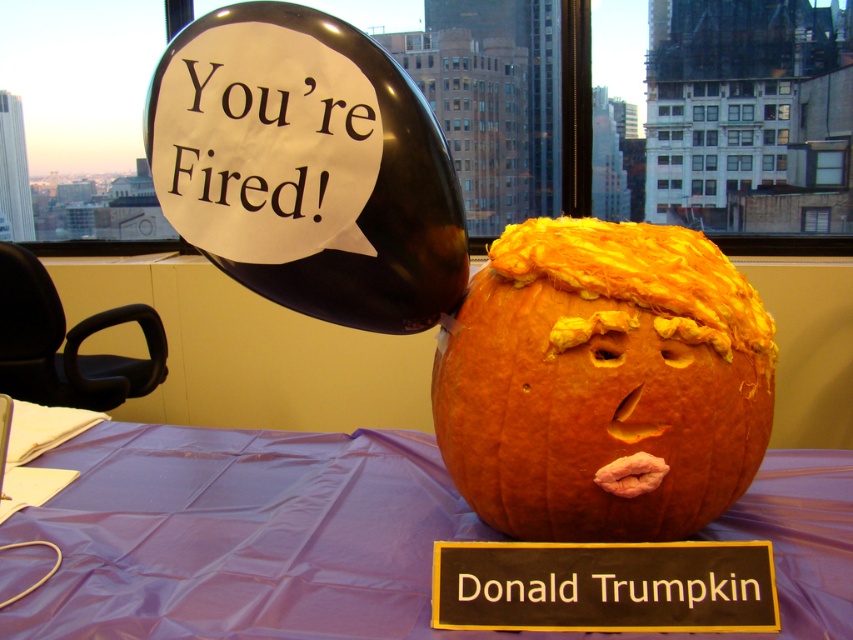
Who is lower down, orange carved pumpkin at center or blackmaterial/texturedonald trumpkin at center?

blackmaterial/texturedonald trumpkin at center

Measure the distance between point (614, 358) and camera.

Point (614, 358) and camera are 23.73 inches apart from each other.

Who is more distant from viewer, (663,292) or (566,584)?

The point (663,292) is behind.

The image size is (853, 640). I want to click on orange carved pumpkin at center, so click(604, 381).

Does orange pumpkin at center have a lesser width compared to blackmaterial/texturedonald trumpkin at center?

Incorrect, orange pumpkin at center's width is not less than blackmaterial/texturedonald trumpkin at center's.

Looking at this image, which of these two, orange pumpkin at center or blackmaterial/texturedonald trumpkin at center, stands shorter?

blackmaterial/texturedonald trumpkin at center is shorter.

Locate an element on the screen. The width and height of the screenshot is (853, 640). orange pumpkin at center is located at coordinates (242, 536).

Locate an element on the screen. The width and height of the screenshot is (853, 640). orange pumpkin at center is located at coordinates 242,536.

Between black paper balloon at upper left and blackmaterial/texturedonald trumpkin at center, which one appears on the right side from the viewer's perspective?

blackmaterial/texturedonald trumpkin at center is more to the right.

Is the position of black paper balloon at upper left more distant than that of blackmaterial/texturedonald trumpkin at center?

No, it is in front of blackmaterial/texturedonald trumpkin at center.

Does point (349, 172) come behind point (602, 588)?

No, it is not.

Where is `black paper balloon at upper left`? black paper balloon at upper left is located at coordinates (312, 168).